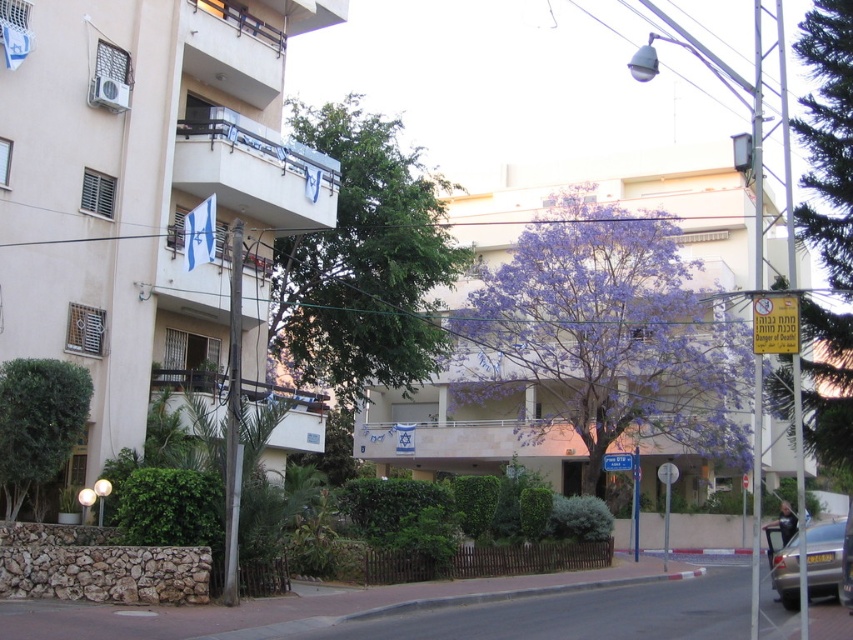
From the picture: You are standing on the sidewalk in front of the beige building with balconies. You see a purple leafy tree at center and a green leafy bush at lower left. Which one is closer to you?

The purple leafy tree at center is closer to you because the green leafy bush at lower left is behind it.

Looking at this image, you are standing on the sidewalk in front of the beige building with balconies. You see a purple leafy tree at center and a green leafy bush at lower left. Which one is higher up in the image?

The purple leafy tree at center is higher up in the image than the green leafy bush at lower left.